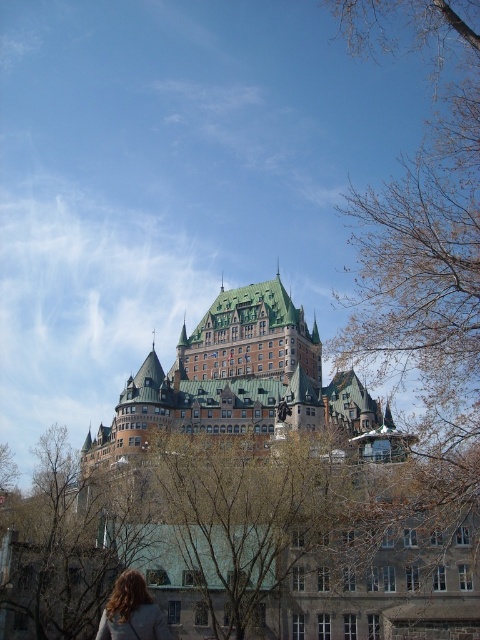
You are a photographer standing in front of the grand historic building. You notice the green leafy tree at center and the blonde hair at lower left in your viewfinder. Which object takes up more space in the photo?

The green leafy tree at center takes up more space in the photo because it is larger in size than the blonde hair at lower left.

From the picture: You are standing in front of the historic building and notice a green leafy tree at center and a blonde hair at lower left. Which object is closer to you?

The green leafy tree at center is closer to you than the blonde hair at lower left because it is further to the viewer.